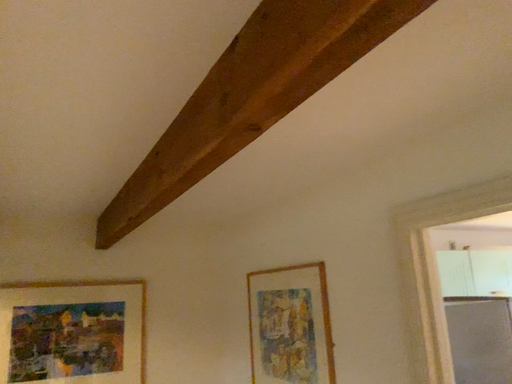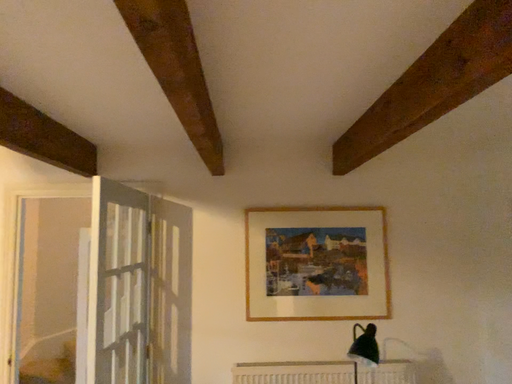
Question: Which way did the camera rotate in the video?

Choices:
 (A) rotated left
 (B) rotated right

Answer: (A)